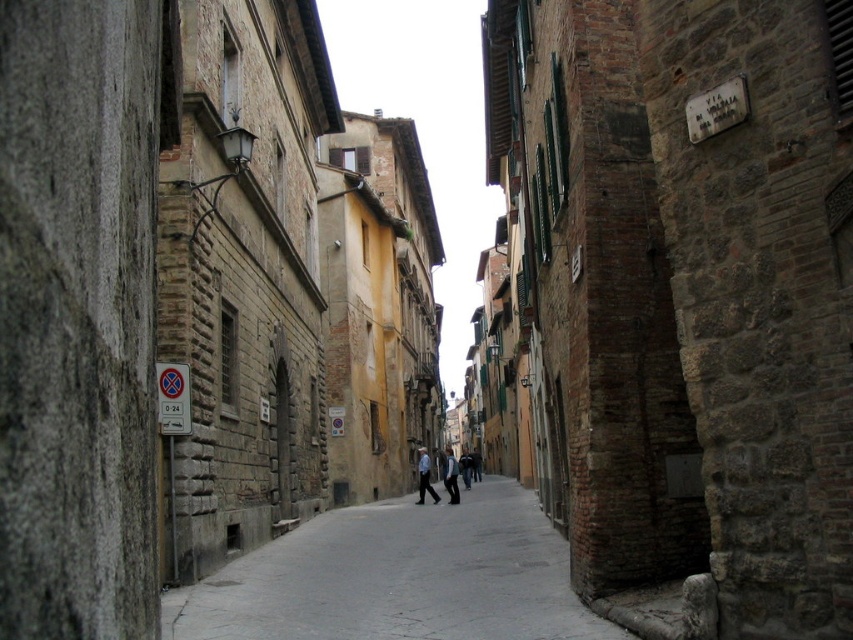
Question: Can you confirm if smooth concrete pavement at center is positioned above blue denim jeans at center?

Choices:
 (A) no
 (B) yes

Answer: (B)

Question: Does blue denim jeans at center have a smaller size compared to light blue denim jacket at center?

Choices:
 (A) yes
 (B) no

Answer: (A)

Question: Does blue denim jeans at center come in front of light blue denim jacket at center?

Choices:
 (A) no
 (B) yes

Answer: (B)

Question: Considering the real-world distances, which object is farthest from the light blue denim jacket at center?

Choices:
 (A) smooth concrete pavement at center
 (B) blue denim jeans at center

Answer: (A)

Question: Based on their relative distances, which object is nearer to the light blue denim jacket at center?

Choices:
 (A) blue denim jeans at center
 (B) smooth concrete pavement at center

Answer: (A)

Question: Which object is closer to the camera taking this photo?

Choices:
 (A) blue denim jeans at center
 (B) light blue denim jacket at center
 (C) smooth concrete pavement at center

Answer: (C)